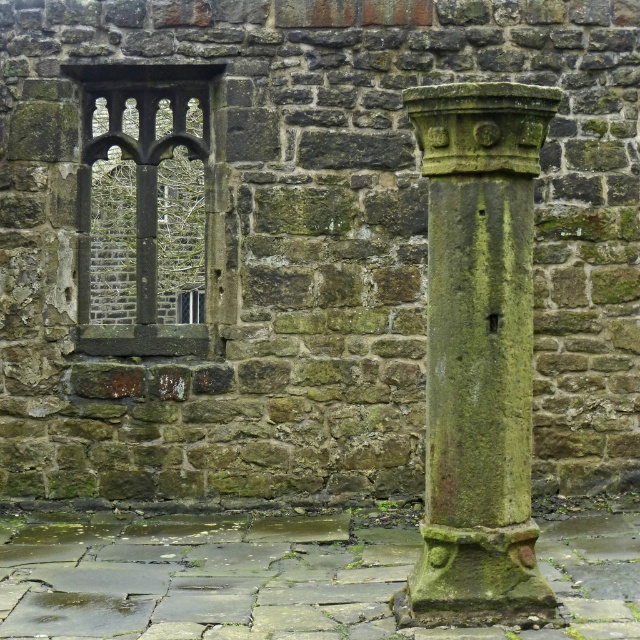
You are an architect examining the old stone wall. You notice the green mossy stone column at right and the dark stone window at upper left. Which object is located to the right of the other?

The green mossy stone column at right is positioned on the right side of dark stone window at upper left.

You are an architect examining the old stone wall. You notice the green mossy stone column at right and the dark stone window at upper left. Which object is smaller in size?

The green mossy stone column at right is smaller in size compared to the dark stone window at upper left.